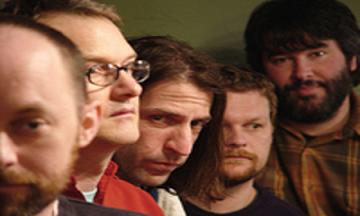
Identify the location of wall. The height and width of the screenshot is (216, 360). (208, 37).